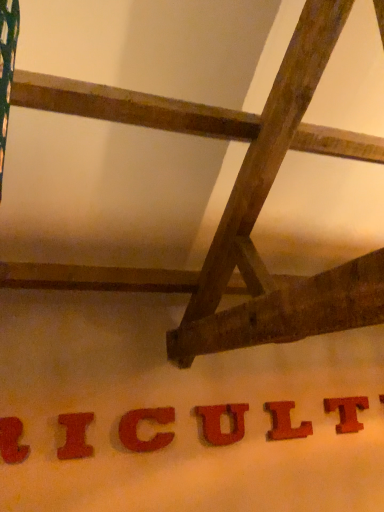
Question: In terms of size, does red wood letter t at lower right, the first letter viewed from the right, appear bigger or smaller than rustic wood letter u at center, marked as the 4th letter in a left-to-right arrangement?

Choices:
 (A) big
 (B) small

Answer: (A)

Question: In the image, is red wood letter t at lower right, the first letter viewed from the right, positioned in front of or behind rustic wood letter u at center, marked as the 4th letter in a left-to-right arrangement?

Choices:
 (A) front
 (B) behind

Answer: (B)

Question: Based on their relative distances, which object is nearer to the wooden letter l at center, the 5th letter viewed from the left?

Choices:
 (A) red matte letter c at center, acting as the fourth letter starting from the right
 (B) red wood letter t at lower right, the sixth letter viewed from the left
 (C) matte red letter at lower left, which is the sixth letter from right to left
 (D) rustic wood letter u at center, the third letter positioned from the right
 (E) matte red letter i at lower left, the second letter positioned from the left

Answer: (D)

Question: Considering the real-world distances, which object is closest to the red wood letter t at lower right, the first letter viewed from the right?

Choices:
 (A) matte red letter at lower left, which is the sixth letter from right to left
 (B) matte red letter i at lower left, marked as the 5th letter in a right-to-left arrangement
 (C) rustic wood letter u at center, the third letter positioned from the right
 (D) wooden letter l at center, arranged as the second letter when viewed from the right
 (E) red matte letter c at center, acting as the fourth letter starting from the right

Answer: (D)